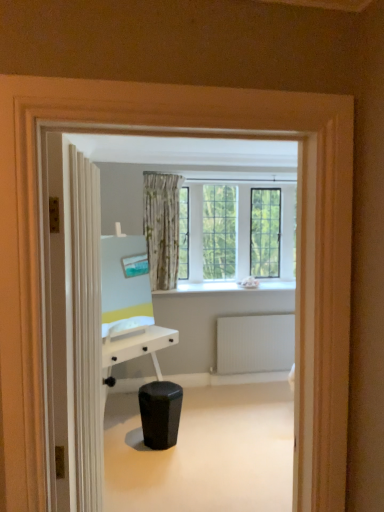
This screenshot has width=384, height=512. What do you see at coordinates (227, 287) in the screenshot?
I see `white smooth window sill at center` at bounding box center [227, 287].

I want to click on black matte music stool at center, so click(160, 413).

How many degrees apart are the facing directions of black matte music stool at center and white smooth window sill at center?

The facing directions of black matte music stool at center and white smooth window sill at center are 137 degrees apart.

Is black matte music stool at center behind white smooth window sill at center?

No, it is not.

From a real-world perspective, is black matte music stool at center on top of white smooth window sill at center?

No, from a real-world perspective, black matte music stool at center is not above white smooth window sill at center.

Which is more to the right, black matte music stool at center or white smooth window sill at center?

white smooth window sill at center is more to the right.

Find the location of `door on the left of black matte music stool at center`. door on the left of black matte music stool at center is located at coordinates (76, 325).

Is white textured door at left bigger than black matte music stool at center?

Yes, white textured door at left is bigger than black matte music stool at center.

Does point (68, 156) come in front of point (174, 391)?

Yes, it is.

Is point (290, 334) closer or farther from the camera than point (99, 342)?

Point (290, 334).

Could white textured door at left be considered to be inside white matte radiator at lower right?

Definitely not — white textured door at left is not inside white matte radiator at lower right.

Which object is further away from the camera taking this photo, white matte radiator at lower right or white textured door at left?

white matte radiator at lower right is further away from the camera.

Which is closer to the camera, (154, 449) or (88, 329)?

Point (154, 449) is farther from the camera than point (88, 329).

How many degrees apart are the facing directions of black matte music stool at center and white textured door at left?

The angular difference between black matte music stool at center and white textured door at left is 142 degrees.

Which object is wider, black matte music stool at center or white textured door at left?

Wider between the two is black matte music stool at center.

Looking at the image, does black matte music stool at center seem bigger or smaller compared to white textured door at left?

black matte music stool at center is smaller than white textured door at left.

Considering the sizes of objects black matte music stool at center and white matte radiator at lower right in the image provided, who is bigger, black matte music stool at center or white matte radiator at lower right?

Bigger between the two is black matte music stool at center.

Between black matte music stool at center and white matte radiator at lower right, which one has larger width?

Wider between the two is black matte music stool at center.

From the image's perspective, which one is positioned lower, black matte music stool at center or white matte radiator at lower right?

black matte music stool at center is shown below in the image.

Considering the relative sizes of black matte music stool at center and white matte radiator at lower right in the image provided, is black matte music stool at center taller than white matte radiator at lower right?

No, black matte music stool at center is not taller than white matte radiator at lower right.

How many degrees apart are the facing directions of white smooth window sill at center and white textured door at left?

There is a 81.2-degree angle between the facing directions of white smooth window sill at center and white textured door at left.

Does white smooth window sill at center lie in front of white textured door at left?

That is False.

Image resolution: width=384 pixels, height=512 pixels. Identify the location of door above the white smooth window sill at center (from a real-world perspective). (76, 325).

Which of these two, white smooth window sill at center or black matte music stool at center, is bigger?

Bigger between the two is white smooth window sill at center.

Considering the relative sizes of white smooth window sill at center and black matte music stool at center in the image provided, is white smooth window sill at center thinner than black matte music stool at center?

No.

Is white smooth window sill at center placed right next to black matte music stool at center?

No, white smooth window sill at center is not next to black matte music stool at center.

At what (x,y) coordinates should I click in order to perform the action: click on music stool in front of the white smooth window sill at center. Please return your answer as a coordinate pair (x, y). This screenshot has height=512, width=384. Looking at the image, I should click on (160, 413).

The height and width of the screenshot is (512, 384). Find the location of `music stool beneath the white textured door at left (from a real-world perspective)`. music stool beneath the white textured door at left (from a real-world perspective) is located at coordinates (160, 413).

Considering their positions, is white textured door at left positioned further to black matte music stool at center than white matte radiator at lower right?

white textured door at left is further to black matte music stool at center.

Which object lies further to the anchor point white matte radiator at lower right, white smooth window sill at center or black matte music stool at center?

black matte music stool at center is further to white matte radiator at lower right.

Which object lies further to the anchor point black matte music stool at center, white textured door at left or white smooth window sill at center?

white textured door at left.

When comparing their distances from white textured door at left, does white smooth window sill at center or black matte music stool at center seem further?

white smooth window sill at center is positioned further to the anchor white textured door at left.

Which object lies further to the anchor point white smooth window sill at center, white textured door at left or white matte radiator at lower right?

The object further to white smooth window sill at center is white textured door at left.

Considering their positions, is black matte music stool at center positioned further to white textured door at left than white smooth window sill at center?

white smooth window sill at center.

Which object lies nearer to the anchor point black matte music stool at center, white smooth window sill at center or white textured door at left?

Based on the image, white smooth window sill at center appears to be nearer to black matte music stool at center.

Which object lies further to the anchor point white smooth window sill at center, white matte radiator at lower right or white textured door at left?

Among the two, white textured door at left is located further to white smooth window sill at center.

Where is `music stool between white textured door at left and white matte radiator at lower right from front to back`? This screenshot has width=384, height=512. music stool between white textured door at left and white matte radiator at lower right from front to back is located at coordinates tap(160, 413).

This screenshot has width=384, height=512. I want to click on music stool between white textured door at left and white smooth window sill at center along the z-axis, so click(160, 413).

I want to click on window sill between black matte music stool at center and white matte radiator at lower right in the front-back direction, so click(227, 287).

Locate an element on the screen. The height and width of the screenshot is (512, 384). window sill positioned between white textured door at left and white matte radiator at lower right from near to far is located at coordinates (227, 287).